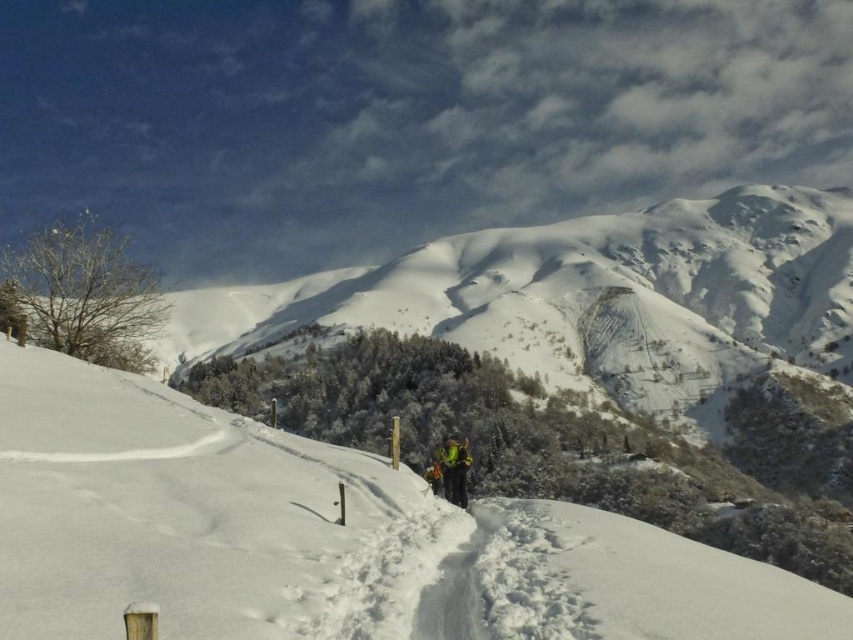
Question: Which object appears closest to the camera in this image?

Choices:
 (A) green fabric jacket at center
 (B) white snow ski slope at center

Answer: (B)

Question: Which point is closer to the camera taking this photo?

Choices:
 (A) (448, 449)
 (B) (578, 609)

Answer: (B)

Question: Is white snow ski slope at center wider than green fabric jacket at center?

Choices:
 (A) yes
 (B) no

Answer: (A)

Question: Does white snow ski slope at center lie in front of green fabric jacket at center?

Choices:
 (A) yes
 (B) no

Answer: (A)

Question: From the image, what is the correct spatial relationship of white snow ski slope at center in relation to green fabric jacket at center?

Choices:
 (A) right
 (B) left

Answer: (B)

Question: Which point appears farthest from the camera in this image?

Choices:
 (A) (120, 556)
 (B) (460, 470)

Answer: (B)